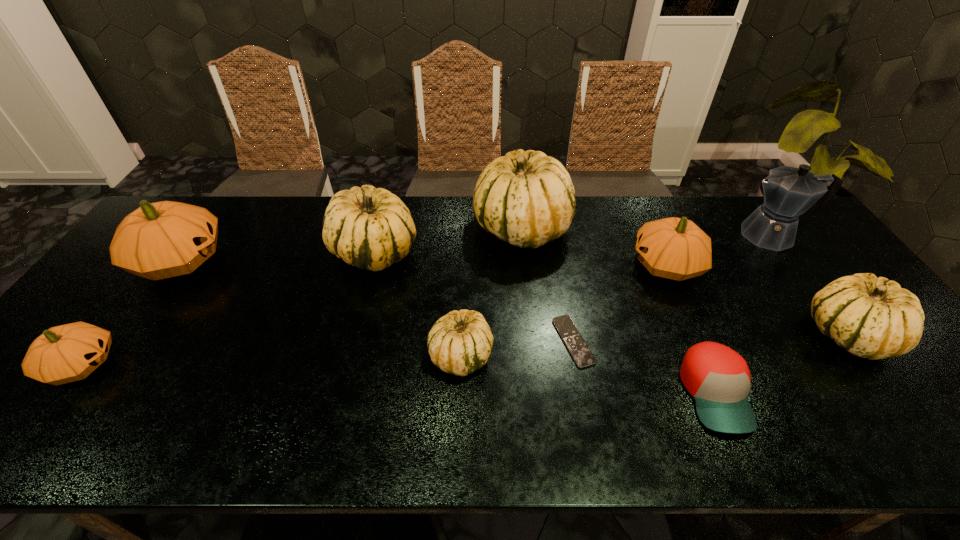
Where is `free area in between the rightmost white gourd and the biggest white gourd`? Image resolution: width=960 pixels, height=540 pixels. free area in between the rightmost white gourd and the biggest white gourd is located at coordinates (684, 281).

This screenshot has width=960, height=540. I want to click on vacant area that lies between the coffeepot and the nearest orange gourd, so click(426, 300).

Identify the location of vacant space that's between the rightmost white gourd and the smallest white gourd. (655, 345).

Where is `free space between the biggest orange gourd and the rightmost orange gourd`? Image resolution: width=960 pixels, height=540 pixels. free space between the biggest orange gourd and the rightmost orange gourd is located at coordinates (423, 263).

This screenshot has width=960, height=540. I want to click on blank region between the rightmost gourd and the red baseball cap, so click(x=781, y=364).

This screenshot has height=540, width=960. Find the location of `vacant area that lies between the third biggest white gourd and the baseball cap`. vacant area that lies between the third biggest white gourd and the baseball cap is located at coordinates (781, 364).

Locate an element on the screen. free space between the smallest white gourd and the biggest orange gourd is located at coordinates (321, 308).

Where is `object that is the seventh closest to the baseball cap`? The height and width of the screenshot is (540, 960). object that is the seventh closest to the baseball cap is located at coordinates (369, 228).

Where is `object that stands as the closest to the baseball cap`? object that stands as the closest to the baseball cap is located at coordinates (580, 352).

Locate an element on the screen. The image size is (960, 540). the fourth closest gourd relative to the biggest white gourd is located at coordinates (871, 317).